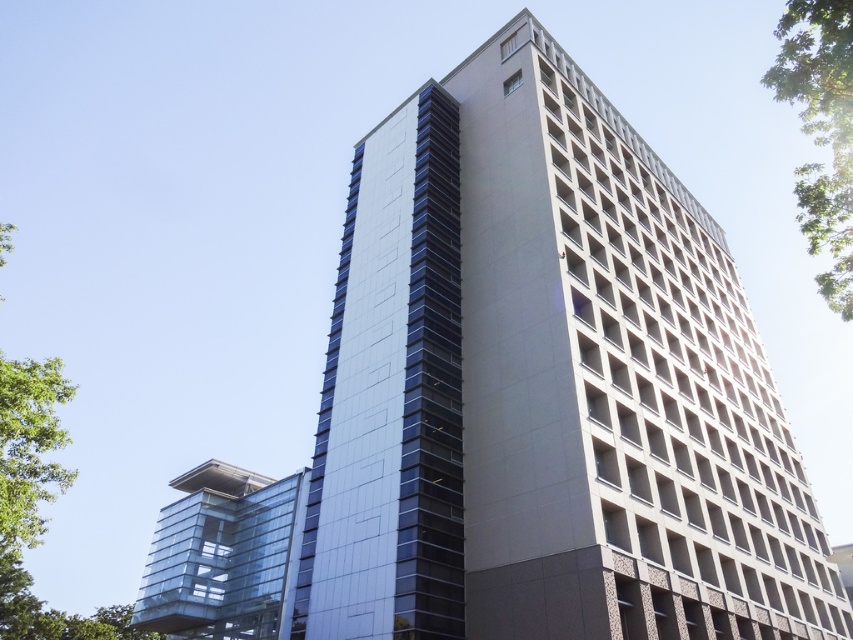
Is glossy glass tower at center further to the viewer compared to transparent glass tower at lower left?

No, glossy glass tower at center is closer to the viewer.

Consider the image. Who is more distant from viewer, (489, 570) or (167, 545)?

The point (167, 545) is behind.

Locate an element on the screen. This screenshot has height=640, width=853. glossy glass tower at center is located at coordinates (546, 387).